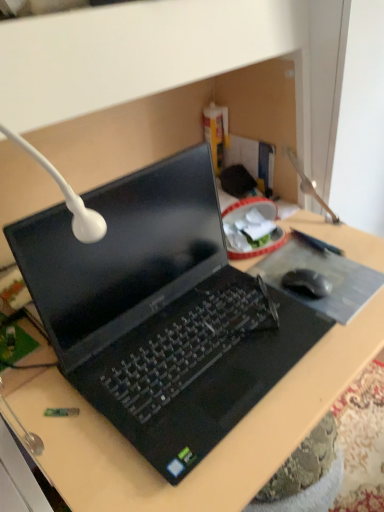
Question: From a real-world perspective, is black rubber mouse at right below black plastic laptop at center?

Choices:
 (A) yes
 (B) no

Answer: (A)

Question: Considering the relative positions of black rubber mouse at right and black plastic laptop at center in the image provided, is black rubber mouse at right to the right of black plastic laptop at center from the viewer's perspective?

Choices:
 (A) no
 (B) yes

Answer: (B)

Question: From the image's perspective, would you say black rubber mouse at right is shown under black plastic laptop at center?

Choices:
 (A) yes
 (B) no

Answer: (A)

Question: Is black rubber mouse at right to the left of black plastic laptop at center from the viewer's perspective?

Choices:
 (A) no
 (B) yes

Answer: (A)

Question: Are black rubber mouse at right and black plastic laptop at center located far from each other?

Choices:
 (A) yes
 (B) no

Answer: (B)

Question: Is black plastic laptop at center taller or shorter than black matte mousepad at center?

Choices:
 (A) tall
 (B) short

Answer: (A)

Question: Considering their positions, is black plastic laptop at center located in front of or behind black matte mousepad at center?

Choices:
 (A) behind
 (B) front

Answer: (B)

Question: From the image's perspective, relative to black matte mousepad at center, is black plastic laptop at center above or below?

Choices:
 (A) above
 (B) below

Answer: (A)

Question: Does point (266, 455) appear closer or farther from the camera than point (317, 253)?

Choices:
 (A) closer
 (B) farther

Answer: (A)

Question: From a real-world perspective, is black matte mousepad at center positioned above or below black rubber mouse at right?

Choices:
 (A) below
 (B) above

Answer: (A)

Question: From their relative heights in the image, would you say black matte mousepad at center is taller or shorter than black rubber mouse at right?

Choices:
 (A) short
 (B) tall

Answer: (A)

Question: From the image's perspective, relative to black rubber mouse at right, is black matte mousepad at center above or below?

Choices:
 (A) above
 (B) below

Answer: (A)

Question: Is black matte mousepad at center to the left or to the right of black rubber mouse at right in the image?

Choices:
 (A) right
 (B) left

Answer: (A)

Question: In terms of height, does black rubber mouse at right look taller or shorter compared to black plastic laptop at center?

Choices:
 (A) short
 (B) tall

Answer: (A)

Question: In terms of size, does black rubber mouse at right appear bigger or smaller than black plastic laptop at center?

Choices:
 (A) big
 (B) small

Answer: (B)